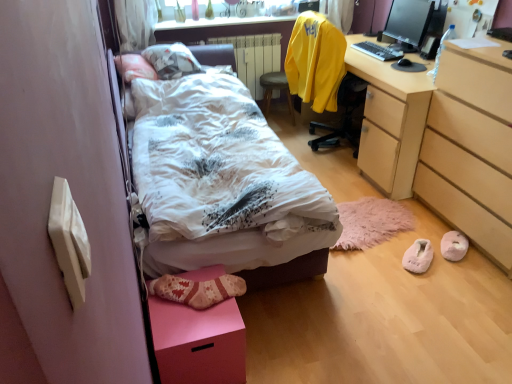
Question: Is light brown wood chest of drawers at lower right directly adjacent to white painted metal radiator at center?

Choices:
 (A) no
 (B) yes

Answer: (A)

Question: Considering the relative sizes of light brown wood chest of drawers at lower right and white painted metal radiator at center in the image provided, is light brown wood chest of drawers at lower right shorter than white painted metal radiator at center?

Choices:
 (A) no
 (B) yes

Answer: (A)

Question: From the image's perspective, does light brown wood chest of drawers at lower right appear higher than white painted metal radiator at center?

Choices:
 (A) yes
 (B) no

Answer: (B)

Question: Is light brown wood chest of drawers at lower right oriented away from white painted metal radiator at center?

Choices:
 (A) yes
 (B) no

Answer: (B)

Question: Does light brown wood chest of drawers at lower right have a larger size compared to white painted metal radiator at center?

Choices:
 (A) yes
 (B) no

Answer: (A)

Question: Would you consider light brown wood chest of drawers at lower right to be distant from white painted metal radiator at center?

Choices:
 (A) no
 (B) yes

Answer: (B)

Question: Can you confirm if light brown wood chest of drawers at lower right is smaller than wooden stool at center?

Choices:
 (A) yes
 (B) no

Answer: (B)

Question: Considering the relative positions of light brown wood chest of drawers at lower right and wooden stool at center in the image provided, is light brown wood chest of drawers at lower right behind wooden stool at center?

Choices:
 (A) yes
 (B) no

Answer: (B)

Question: Can you confirm if light brown wood chest of drawers at lower right is positioned to the right of wooden stool at center?

Choices:
 (A) no
 (B) yes

Answer: (B)

Question: From the image's perspective, is light brown wood chest of drawers at lower right above wooden stool at center?

Choices:
 (A) no
 (B) yes

Answer: (A)

Question: From a real-world perspective, is light brown wood chest of drawers at lower right physically above wooden stool at center?

Choices:
 (A) yes
 (B) no

Answer: (A)

Question: Are light brown wood chest of drawers at lower right and wooden stool at center making contact?

Choices:
 (A) no
 (B) yes

Answer: (A)

Question: Is white soft bed at center in front of peachy suede slippers at lower right, which is the 2th footwear in left-to-right order?

Choices:
 (A) no
 (B) yes

Answer: (B)